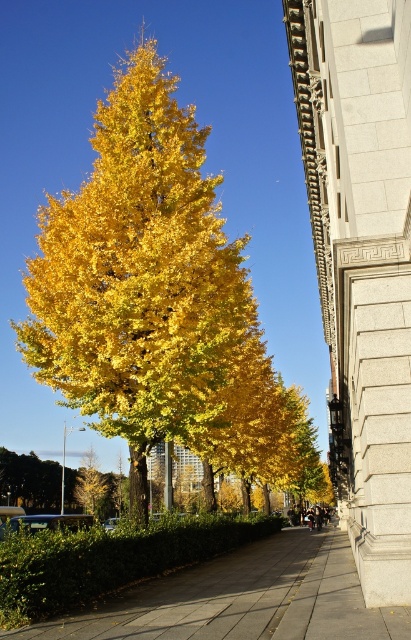
Between golden leafy tree at center and smooth concrete pavement at center, which one has less height?

smooth concrete pavement at center is shorter.

Which is more to the left, golden leafy tree at center or smooth concrete pavement at center?

golden leafy tree at center

Is point (43, 289) positioned in front of point (214, 582)?

No, it is behind (214, 582).

This screenshot has width=411, height=640. I want to click on golden leafy tree at center, so click(157, 300).